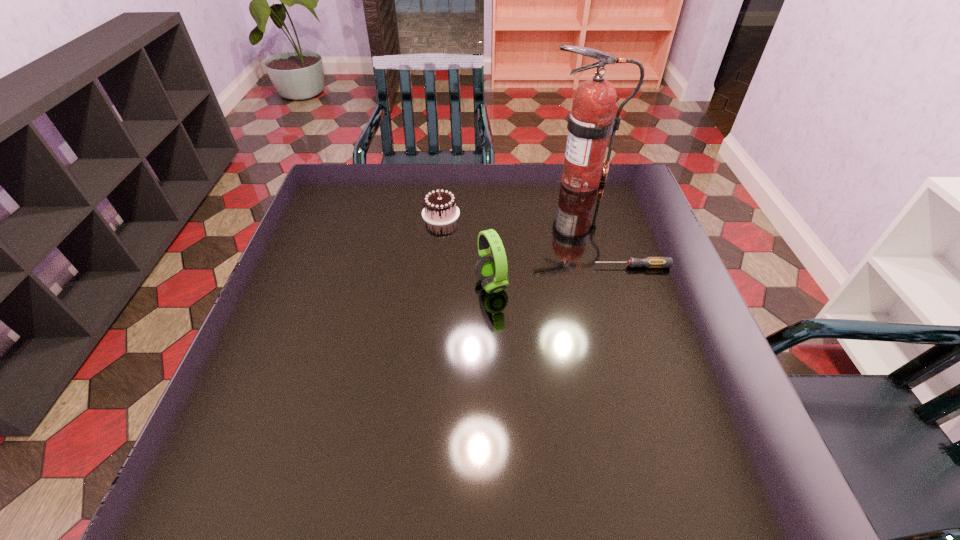
You are a GUI agent. You are given a task and a screenshot of the screen. Output one action in this format:
    pyautogui.click(x=<x>, y=<y>)
    Task: Click on the empty space that is in between the shortest object and the leftmost object
    The image size is (960, 540).
    Given the screenshot: What is the action you would take?
    pyautogui.click(x=537, y=240)

Find the location of a particular element. This screenshot has height=540, width=960. free space between the second tallest object and the shortest object is located at coordinates (562, 275).

Find the location of a particular element. The width and height of the screenshot is (960, 540). blank region between the farthest object and the screwdriver is located at coordinates (606, 224).

At what (x,y) coordinates should I click in order to perform the action: click on free space between the leftmost object and the shortest object. Please return your answer as a coordinate pair (x, y). The image size is (960, 540). Looking at the image, I should click on pyautogui.click(x=537, y=240).

You are a GUI agent. You are given a task and a screenshot of the screen. Output one action in this format:
    pyautogui.click(x=<x>, y=<y>)
    Task: Click on the free space between the second tallest object and the tallest object
    
    Given the screenshot: What is the action you would take?
    pyautogui.click(x=536, y=233)

Where is `object that is the third closest to the leftmost object`? object that is the third closest to the leftmost object is located at coordinates (651, 262).

Locate an element on the screen. object that is the nearest to the fire extinguisher is located at coordinates (440, 208).

Identify the location of vacant space that satisfies the following two spatial constraints: 1. insert the screwdriver into a screw head; 2. on the front side of the third object from right to left. (638, 285).